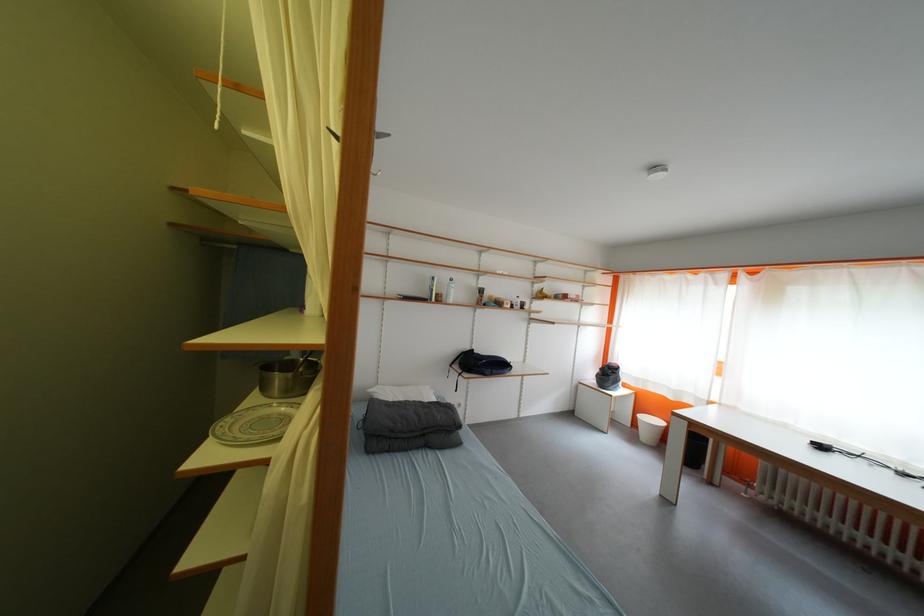
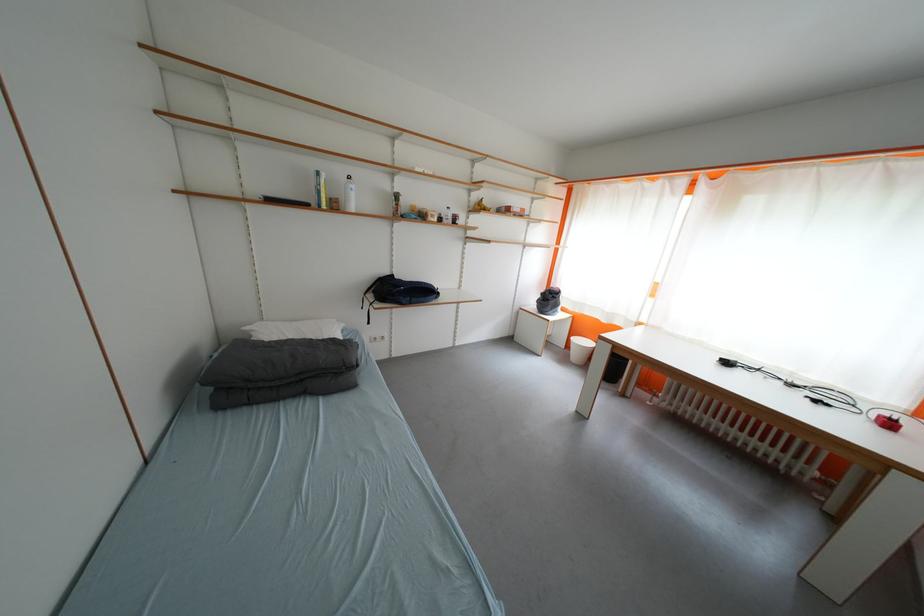
Where in the second image is the point corresponding to pixel 639 436 from the first image?

(572, 358)